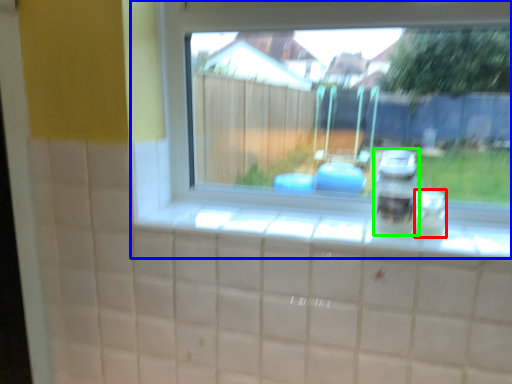
Question: Which is nearer to the glass jar (highlighted by a red box)? window (highlighted by a blue box) or appliance (highlighted by a green box).

Choices:
 (A) window
 (B) appliance

Answer: (B)